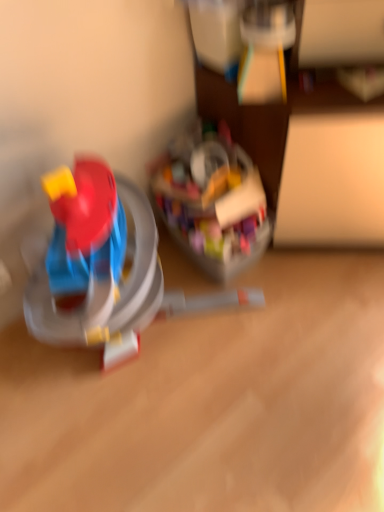
What is the approximate width of translucent plastic container at center, acting as the first toy starting from the right?

translucent plastic container at center, acting as the first toy starting from the right, is 15.93 inches in width.

The width and height of the screenshot is (384, 512). Describe the element at coordinates (212, 202) in the screenshot. I see `translucent plastic container at center, the 2th toy from the left` at that location.

The image size is (384, 512). Find the location of `translucent plastic container at center, acting as the first toy starting from the right`. translucent plastic container at center, acting as the first toy starting from the right is located at coordinates (212, 202).

You are a GUI agent. You are given a task and a screenshot of the screen. Output one action in this format:
    pyautogui.click(x=<x>, y=<y>)
    Task: Click on the translucent plastic toy at center, which is the first toy in left-to-right order
    
    Given the screenshot: What is the action you would take?
    pyautogui.click(x=105, y=266)

This screenshot has width=384, height=512. Describe the element at coordinates (105, 266) in the screenshot. I see `translucent plastic toy at center, marked as the second toy in a right-to-left arrangement` at that location.

Locate an element on the screen. This screenshot has width=384, height=512. translucent plastic container at center, acting as the first toy starting from the right is located at coordinates (212, 202).

Between translucent plastic container at center, the 2th toy from the left, and translucent plastic toy at center, marked as the second toy in a right-to-left arrangement, which one appears on the left side from the viewer's perspective?

translucent plastic toy at center, marked as the second toy in a right-to-left arrangement.

Does translucent plastic container at center, acting as the first toy starting from the right, lie in front of translucent plastic toy at center, which is the first toy in left-to-right order?

No, it is not.

Is point (232, 147) closer to viewer compared to point (100, 208)?

That is False.

From the image's perspective, is translucent plastic container at center, acting as the first toy starting from the right, below translucent plastic toy at center, which is the first toy in left-to-right order?

No, from the image's perspective, translucent plastic container at center, acting as the first toy starting from the right, is not below translucent plastic toy at center, which is the first toy in left-to-right order.

From a real-world perspective, is translucent plastic container at center, the 2th toy from the left, below translucent plastic toy at center, which is the first toy in left-to-right order?

Correct, in the physical world, translucent plastic container at center, the 2th toy from the left, is lower than translucent plastic toy at center, which is the first toy in left-to-right order.

Is translucent plastic container at center, the 2th toy from the left, wider than translucent plastic toy at center, marked as the second toy in a right-to-left arrangement?

Incorrect, the width of translucent plastic container at center, the 2th toy from the left, does not surpass that of translucent plastic toy at center, marked as the second toy in a right-to-left arrangement.

Considering the sizes of objects translucent plastic container at center, the 2th toy from the left, and translucent plastic toy at center, which is the first toy in left-to-right order, in the image provided, who is shorter, translucent plastic container at center, the 2th toy from the left, or translucent plastic toy at center, which is the first toy in left-to-right order,?

translucent plastic container at center, the 2th toy from the left.

Is translucent plastic container at center, the 2th toy from the left, bigger or smaller than translucent plastic toy at center, marked as the second toy in a right-to-left arrangement?

Considering their sizes, translucent plastic container at center, the 2th toy from the left, takes up less space than translucent plastic toy at center, marked as the second toy in a right-to-left arrangement.

Is translucent plastic container at center, the 2th toy from the left, spatially inside translucent plastic toy at center, which is the first toy in left-to-right order, or outside of it?

translucent plastic container at center, the 2th toy from the left, is enclosed within translucent plastic toy at center, which is the first toy in left-to-right order.

Is translucent plastic container at center, the 2th toy from the left, next to translucent plastic toy at center, marked as the second toy in a right-to-left arrangement?

No, translucent plastic container at center, the 2th toy from the left, is not beside translucent plastic toy at center, marked as the second toy in a right-to-left arrangement.

Is translucent plastic container at center, acting as the first toy starting from the right, positioned with its back to translucent plastic toy at center, marked as the second toy in a right-to-left arrangement?

Yes, translucent plastic toy at center, marked as the second toy in a right-to-left arrangement, is at the back of translucent plastic container at center, acting as the first toy starting from the right.

Where is `toy below the translucent plastic toy at center, marked as the second toy in a right-to-left arrangement (from a real-world perspective)`? The image size is (384, 512). toy below the translucent plastic toy at center, marked as the second toy in a right-to-left arrangement (from a real-world perspective) is located at coordinates (212, 202).

Does translucent plastic toy at center, marked as the second toy in a right-to-left arrangement, appear on the left side of translucent plastic container at center, acting as the first toy starting from the right?

Yes.

In the image, is translucent plastic toy at center, marked as the second toy in a right-to-left arrangement, positioned in front of or behind translucent plastic container at center, the 2th toy from the left?

Clearly, translucent plastic toy at center, marked as the second toy in a right-to-left arrangement, is in front of translucent plastic container at center, the 2th toy from the left.

Is point (149, 253) closer or farther from the camera than point (238, 260)?

Point (149, 253).

From the picture: From the image's perspective, between translucent plastic toy at center, marked as the second toy in a right-to-left arrangement, and translucent plastic container at center, the 2th toy from the left, who is located below?

translucent plastic toy at center, marked as the second toy in a right-to-left arrangement.

From a real-world perspective, who is located higher, translucent plastic toy at center, marked as the second toy in a right-to-left arrangement, or translucent plastic container at center, the 2th toy from the left?

translucent plastic toy at center, marked as the second toy in a right-to-left arrangement, is physically above.

Between translucent plastic toy at center, which is the first toy in left-to-right order, and translucent plastic container at center, acting as the first toy starting from the right, which one has smaller width?

translucent plastic container at center, acting as the first toy starting from the right.

Who is shorter, translucent plastic toy at center, which is the first toy in left-to-right order, or translucent plastic container at center, the 2th toy from the left?

Standing shorter between the two is translucent plastic container at center, the 2th toy from the left.

Considering the sizes of objects translucent plastic toy at center, marked as the second toy in a right-to-left arrangement, and translucent plastic container at center, the 2th toy from the left, in the image provided, who is bigger, translucent plastic toy at center, marked as the second toy in a right-to-left arrangement, or translucent plastic container at center, the 2th toy from the left,?

With larger size is translucent plastic toy at center, marked as the second toy in a right-to-left arrangement.

Is translucent plastic toy at center, marked as the second toy in a right-to-left arrangement, outside of translucent plastic container at center, acting as the first toy starting from the right?

translucent plastic toy at center, marked as the second toy in a right-to-left arrangement, lies outside translucent plastic container at center, acting as the first toy starting from the right,'s area.

Are translucent plastic toy at center, which is the first toy in left-to-right order, and translucent plastic container at center, acting as the first toy starting from the right, beside each other?

No, translucent plastic toy at center, which is the first toy in left-to-right order, is not touching translucent plastic container at center, acting as the first toy starting from the right.

Is translucent plastic toy at center, marked as the second toy in a right-to-left arrangement, oriented towards translucent plastic container at center, acting as the first toy starting from the right?

No, translucent plastic toy at center, marked as the second toy in a right-to-left arrangement, is not facing towards translucent plastic container at center, acting as the first toy starting from the right.

Can you tell me how much translucent plastic toy at center, which is the first toy in left-to-right order, and translucent plastic container at center, the 2th toy from the left, differ in facing direction?

There is a 5.16-degree angle between the facing directions of translucent plastic toy at center, which is the first toy in left-to-right order, and translucent plastic container at center, the 2th toy from the left.

Where is `toy located on the right of translucent plastic toy at center, marked as the second toy in a right-to-left arrangement`? This screenshot has height=512, width=384. toy located on the right of translucent plastic toy at center, marked as the second toy in a right-to-left arrangement is located at coordinates (212, 202).

Where is `toy that is below the translucent plastic container at center, the 2th toy from the left (from the image's perspective)`? toy that is below the translucent plastic container at center, the 2th toy from the left (from the image's perspective) is located at coordinates (105, 266).

The height and width of the screenshot is (512, 384). I want to click on toy above the translucent plastic toy at center, which is the first toy in left-to-right order (from the image's perspective), so click(212, 202).